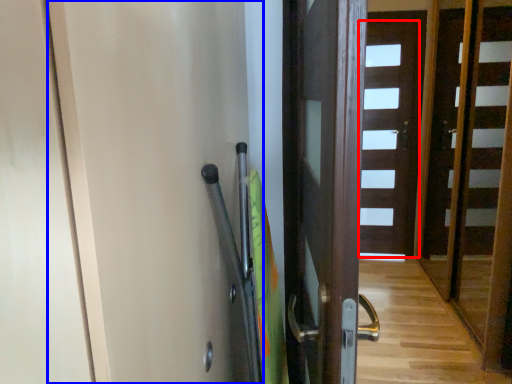
Question: Which point is closer to the camera, door (highlighted by a red box) or screen door (highlighted by a blue box)?

Choices:
 (A) door
 (B) screen door

Answer: (B)